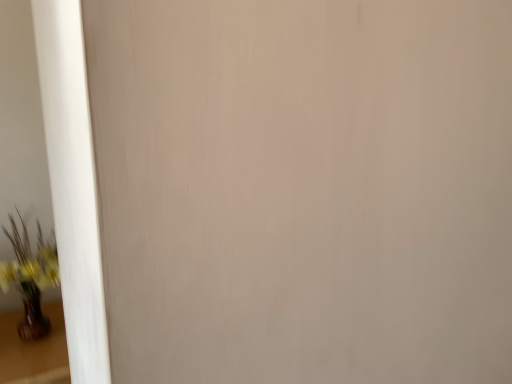
Identify the location of brown glossy vase at lower left. (34, 350).

What do you see at coordinates (34, 350) in the screenshot? Image resolution: width=512 pixels, height=384 pixels. I see `brown glossy vase at lower left` at bounding box center [34, 350].

This screenshot has width=512, height=384. What are the coordinates of `matte brown vase at lower left` in the screenshot? It's located at (30, 277).

Image resolution: width=512 pixels, height=384 pixels. What do you see at coordinates (30, 277) in the screenshot? I see `matte brown vase at lower left` at bounding box center [30, 277].

This screenshot has width=512, height=384. I want to click on brown glossy vase at lower left, so click(34, 350).

Considering the positions of objects matte brown vase at lower left and brown glossy vase at lower left in the image provided, who is more to the right, matte brown vase at lower left or brown glossy vase at lower left?

Positioned to the right is matte brown vase at lower left.

Which object is more forward, matte brown vase at lower left or brown glossy vase at lower left?

brown glossy vase at lower left is in front.

Does point (30, 316) lie behind point (63, 375)?

Yes, point (30, 316) is farther from viewer.

From the image's perspective, between matte brown vase at lower left and brown glossy vase at lower left, which one is located above?

From the image's view, matte brown vase at lower left is above.

From a real-world perspective, is matte brown vase at lower left over brown glossy vase at lower left?

Yes, from a real-world perspective, matte brown vase at lower left is on top of brown glossy vase at lower left.

Which object is thinner, matte brown vase at lower left or brown glossy vase at lower left?

matte brown vase at lower left is thinner.

Considering the sizes of matte brown vase at lower left and brown glossy vase at lower left in the image, is matte brown vase at lower left taller or shorter than brown glossy vase at lower left?

In the image, matte brown vase at lower left appears to be taller than brown glossy vase at lower left.

Can you confirm if matte brown vase at lower left is smaller than brown glossy vase at lower left?

Correct, matte brown vase at lower left occupies less space than brown glossy vase at lower left.

Is brown glossy vase at lower left inside matte brown vase at lower left?

No.

In the scene shown: Is matte brown vase at lower left next to brown glossy vase at lower left?

No, matte brown vase at lower left is not making contact with brown glossy vase at lower left.

Is matte brown vase at lower left turned away from brown glossy vase at lower left?

matte brown vase at lower left is not turned away from brown glossy vase at lower left.

Locate an element on the screen. The width and height of the screenshot is (512, 384). houseplant above the brown glossy vase at lower left (from the image's perspective) is located at coordinates (30, 277).

Considering the relative positions of brown glossy vase at lower left and matte brown vase at lower left in the image provided, is brown glossy vase at lower left to the left of matte brown vase at lower left from the viewer's perspective?

Indeed, brown glossy vase at lower left is positioned on the left side of matte brown vase at lower left.

Is brown glossy vase at lower left positioned in front of matte brown vase at lower left?

Yes, it is in front of matte brown vase at lower left.

Between point (60, 361) and point (0, 262), which one is positioned in front?

Positioned in front is point (60, 361).

From the image's perspective, is brown glossy vase at lower left under matte brown vase at lower left?

Yes, from the image's perspective, brown glossy vase at lower left is beneath matte brown vase at lower left.

From a real-world perspective, is brown glossy vase at lower left beneath matte brown vase at lower left?

Yes, from a real-world perspective, brown glossy vase at lower left is beneath matte brown vase at lower left.

Which object is wider, brown glossy vase at lower left or matte brown vase at lower left?

brown glossy vase at lower left is wider.

Which of these two, brown glossy vase at lower left or matte brown vase at lower left, stands shorter?

With less height is brown glossy vase at lower left.

Consider the image. Based on their sizes in the image, would you say brown glossy vase at lower left is bigger or smaller than matte brown vase at lower left?

Clearly, brown glossy vase at lower left is larger in size than matte brown vase at lower left.

Is brown glossy vase at lower left inside or outside of matte brown vase at lower left?

brown glossy vase at lower left cannot be found inside matte brown vase at lower left.

Would you say brown glossy vase at lower left is a long distance from matte brown vase at lower left?

Actually, brown glossy vase at lower left and matte brown vase at lower left are a little close together.

Could you tell me if brown glossy vase at lower left is turned towards matte brown vase at lower left?

No, brown glossy vase at lower left is not aimed at matte brown vase at lower left.

How different are the orientations of brown glossy vase at lower left and matte brown vase at lower left in degrees?

3.67 degrees.

Where is `houseplant lying above the brown glossy vase at lower left (from the image's perspective)`? Image resolution: width=512 pixels, height=384 pixels. houseplant lying above the brown glossy vase at lower left (from the image's perspective) is located at coordinates (30, 277).

Image resolution: width=512 pixels, height=384 pixels. Identify the location of table that appears below the matte brown vase at lower left (from the image's perspective). pos(34,350).

Identify the location of table in front of the matte brown vase at lower left. The height and width of the screenshot is (384, 512). (34, 350).